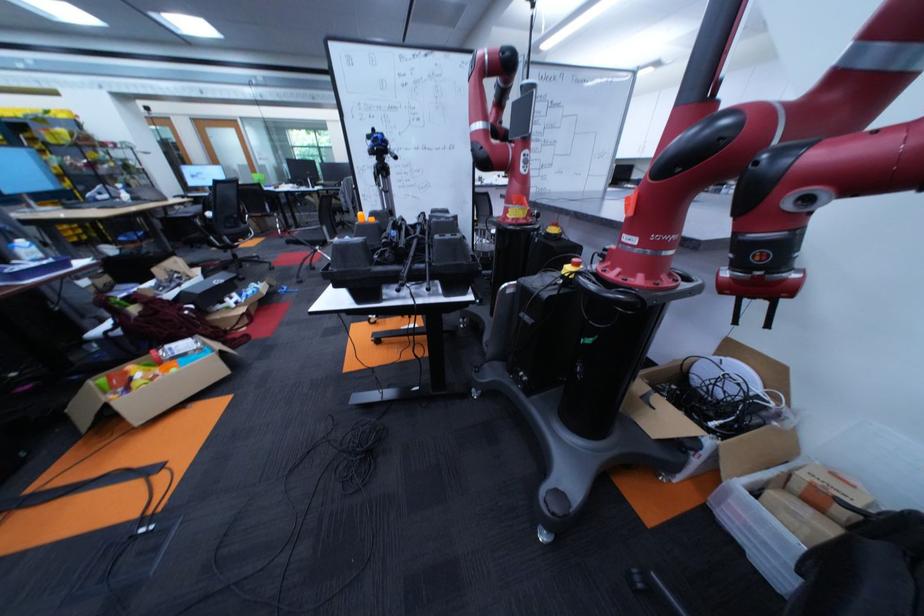
Image resolution: width=924 pixels, height=616 pixels. What do you see at coordinates (807, 203) in the screenshot?
I see `the robot base handle` at bounding box center [807, 203].